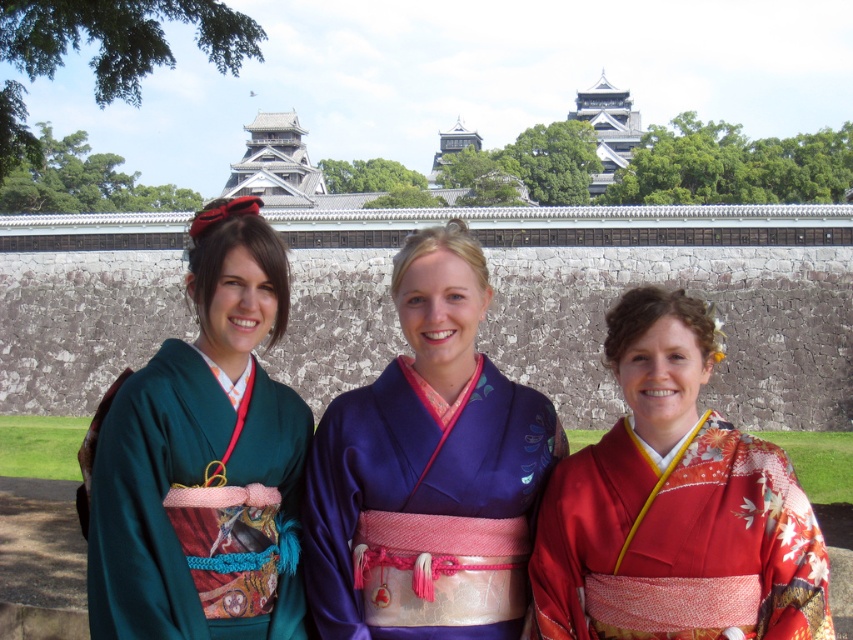
Does silky blue kimono at center have a smaller size compared to shiny red kimono at center?

Yes, silky blue kimono at center is smaller than shiny red kimono at center.

Image resolution: width=853 pixels, height=640 pixels. In order to click on silky blue kimono at center in this screenshot , I will do `click(428, 470)`.

Is the position of green silk kimono at left less distant than that of shiny red kimono at center?

No, it is behind shiny red kimono at center.

What are the coordinates of `green silk kimono at left` in the screenshot? It's located at (204, 460).

I want to click on green silk kimono at left, so [x=204, y=460].

Is silky blue kimono at center thinner than green silk kimono at left?

In fact, silky blue kimono at center might be wider than green silk kimono at left.

Is silky blue kimono at center to the right of green silk kimono at left from the viewer's perspective?

Correct, you'll find silky blue kimono at center to the right of green silk kimono at left.

Is point (320, 429) positioned in front of point (244, 452)?

No, (320, 429) is behind (244, 452).

This screenshot has height=640, width=853. What are the coordinates of `silky blue kimono at center` in the screenshot? It's located at [428, 470].